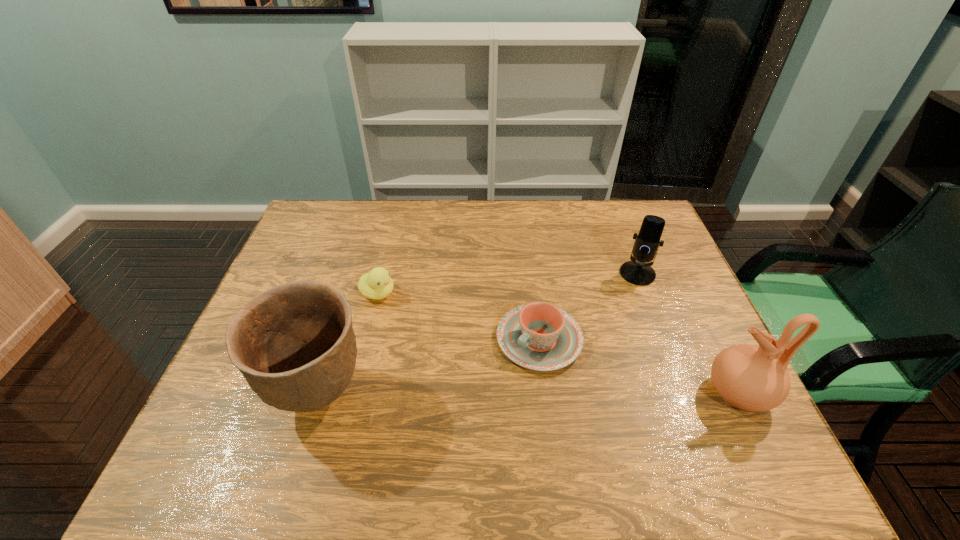
I want to click on vacant region between the rightmost object and the chinaware, so click(639, 366).

At what (x,y) coordinates should I click in order to perform the action: click on free space between the duckling and the chinaware. Please return your answer as a coordinate pair (x, y). The image size is (960, 540). Looking at the image, I should click on (458, 316).

Identify the location of free space between the left pottery and the rightmost object. (529, 394).

At what (x,y) coordinates should I click in order to perform the action: click on free point between the second object from right to left and the duckling. Please return your answer as a coordinate pair (x, y). This screenshot has height=540, width=960. Looking at the image, I should click on (507, 284).

You are a GUI agent. You are given a task and a screenshot of the screen. Output one action in this format:
    pyautogui.click(x=<x>, y=<y>)
    Task: Click on the free area in between the left pottery and the microphone
    This screenshot has width=960, height=540.
    Given the screenshot: What is the action you would take?
    [478, 334]

I want to click on vacant space that is in between the third shortest object and the third object from left to right, so click(588, 307).

This screenshot has width=960, height=540. In order to click on vacant area that lies between the right pottery and the left pottery in this screenshot , I will do `click(529, 394)`.

This screenshot has height=540, width=960. Identify the location of object that is the second closest one to the third object from left to right. pos(747,377).

Find the location of a particular element. Image resolution: width=960 pixels, height=540 pixels. the closest object to the right pottery is located at coordinates (539, 336).

I want to click on vacant point that satisfies the following two spatial constraints: 1. on the back side of the left pottery; 2. on the spout of the right pottery, so click(x=320, y=393).